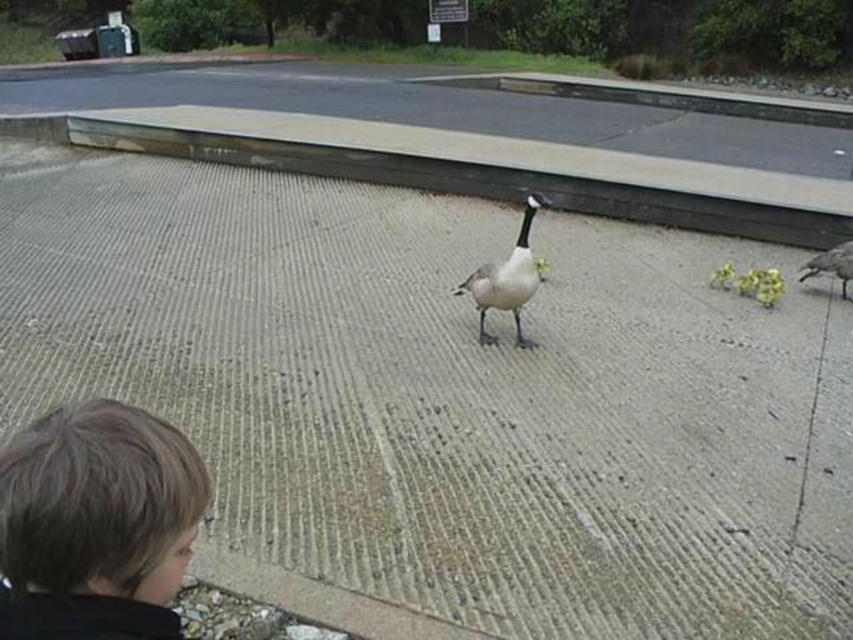
Question: Considering the real-world distances, which object is closest to the gray matte goose at right?

Choices:
 (A) white matte duck at center
 (B) gray concrete curb at center
 (C) brown hair at lower left

Answer: (B)

Question: Among these objects, which one is farthest from the camera?

Choices:
 (A) brown hair at lower left
 (B) gray concrete curb at center
 (C) white matte duck at center

Answer: (B)

Question: Is gray concrete curb at center below gray matte goose at right?

Choices:
 (A) yes
 (B) no

Answer: (B)

Question: Is gray concrete curb at center smaller than white matte duck at center?

Choices:
 (A) yes
 (B) no

Answer: (A)

Question: Which of the following is the closest to the observer?

Choices:
 (A) gray matte goose at right
 (B) gray concrete curb at center
 (C) white matte duck at center
 (D) brown hair at lower left

Answer: (D)

Question: Is gray concrete curb at center wider than gray matte goose at right?

Choices:
 (A) no
 (B) yes

Answer: (A)